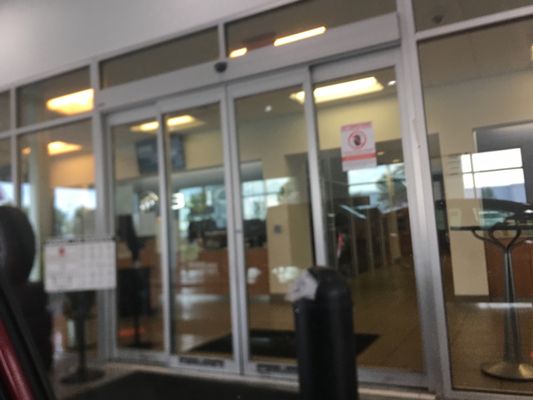
The width and height of the screenshot is (533, 400). In order to click on top windows in this screenshot , I will do `click(40, 100)`, `click(5, 106)`, `click(154, 69)`, `click(290, 29)`, `click(450, 12)`.